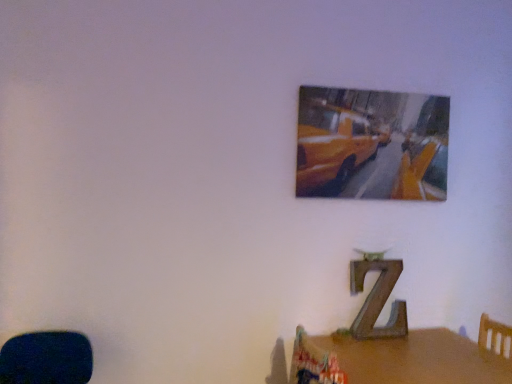
Question: Considering the positions of point (436, 377) and point (340, 129), is point (436, 377) closer or farther from the camera than point (340, 129)?

Choices:
 (A) farther
 (B) closer

Answer: (B)

Question: Is brown wooden table at lower right wider or thinner than metallic yellow taxi at upper center?

Choices:
 (A) wide
 (B) thin

Answer: (A)

Question: Is brown wooden table at lower right spatially inside metallic yellow taxi at upper center, or outside of it?

Choices:
 (A) outside
 (B) inside

Answer: (A)

Question: Is metallic yellow taxi at upper center bigger or smaller than brown wooden table at lower right?

Choices:
 (A) big
 (B) small

Answer: (B)

Question: In the image, is metallic yellow taxi at upper center on the left side or the right side of brown wooden table at lower right?

Choices:
 (A) left
 (B) right

Answer: (A)

Question: Is metallic yellow taxi at upper center situated inside brown wooden table at lower right or outside?

Choices:
 (A) inside
 (B) outside

Answer: (B)

Question: From the image's perspective, is metallic yellow taxi at upper center positioned above or below brown wooden table at lower right?

Choices:
 (A) above
 (B) below

Answer: (A)